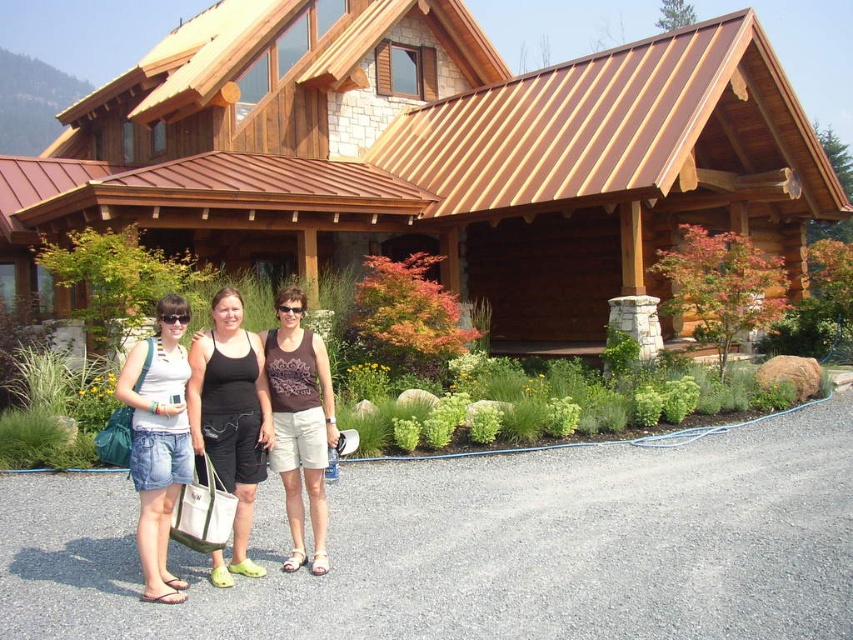
You are a photographer setting up a photo shoot in front of the rustic house. You have two subjects wearing black fabric shorts at center and denim shorts at center. To ensure both are visible in the photo, which subject should be moved forward?

The denim shorts at center should be moved forward because it is currently behind the black fabric shorts at center, making it less visible.

You are a fashion designer observing a model wearing the denim shorts at center and brown fabric tank top at center. Which clothing item is located lower on the model?

The denim shorts at center is positioned under the brown fabric tank top at center, so the denim shorts at center is located lower on the model.